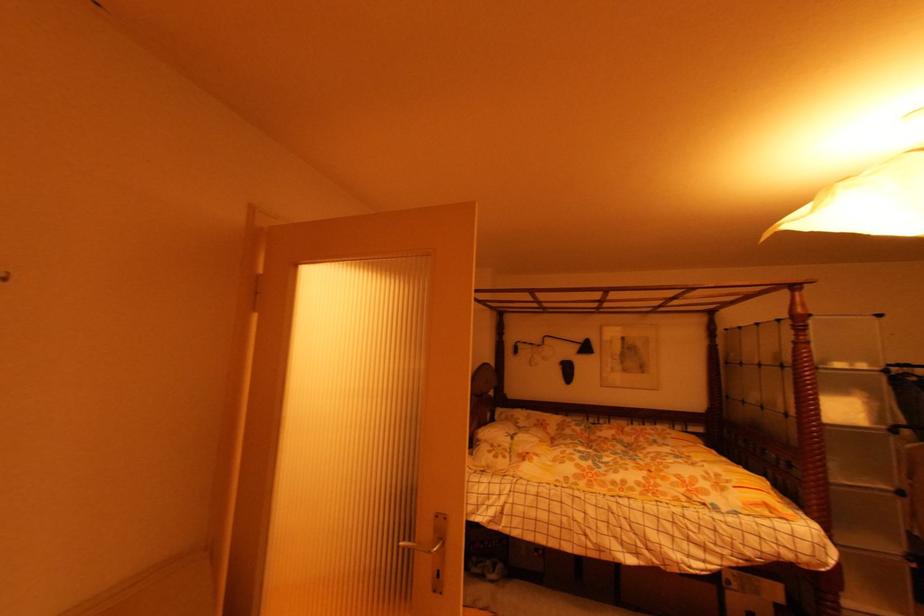
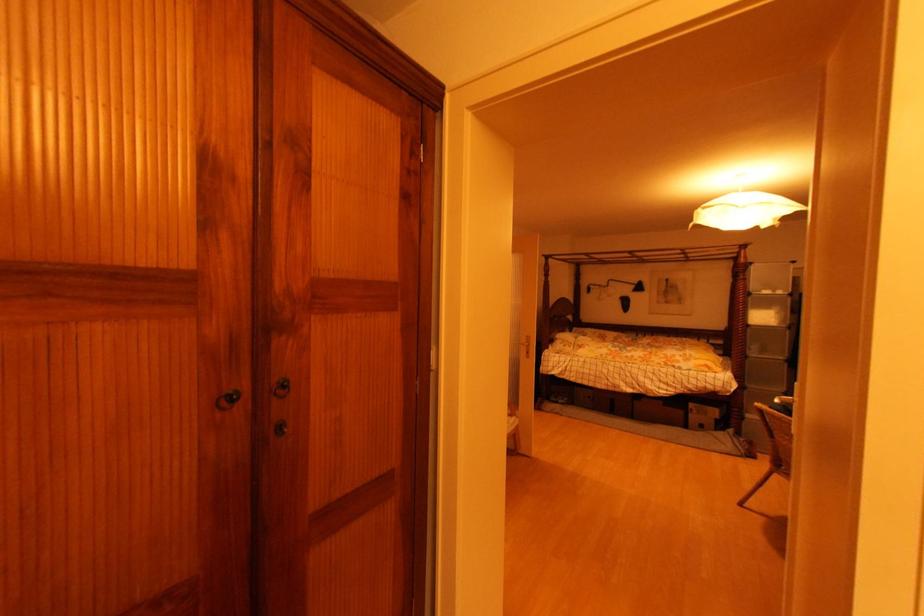
Where in the second image is the point corresponding to (844,480) from the first image?

(759, 355)